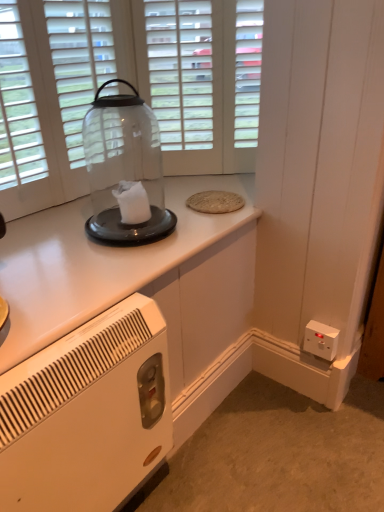
Question: Is the depth of white plastic heater at lower left greater than that of white plastic electrical outlet at lower right?

Choices:
 (A) no
 (B) yes

Answer: (A)

Question: Is the position of white plastic heater at lower left less distant than that of white plastic electrical outlet at lower right?

Choices:
 (A) yes
 (B) no

Answer: (A)

Question: From the image's perspective, is white plastic heater at lower left beneath white plastic electrical outlet at lower right?

Choices:
 (A) yes
 (B) no

Answer: (A)

Question: Considering the relative sizes of white plastic heater at lower left and white plastic electrical outlet at lower right in the image provided, is white plastic heater at lower left wider than white plastic electrical outlet at lower right?

Choices:
 (A) no
 (B) yes

Answer: (B)

Question: From the image's perspective, does white plastic heater at lower left appear higher than white plastic electrical outlet at lower right?

Choices:
 (A) no
 (B) yes

Answer: (A)

Question: Is white plastic heater at lower left thinner than white plastic electrical outlet at lower right?

Choices:
 (A) no
 (B) yes

Answer: (A)

Question: Is white glossy cabinet at upper center at the right side of transparent glass door at upper center?

Choices:
 (A) yes
 (B) no

Answer: (B)

Question: Is white glossy cabinet at upper center in contact with transparent glass door at upper center?

Choices:
 (A) no
 (B) yes

Answer: (A)

Question: Does white glossy cabinet at upper center have a lesser height compared to transparent glass door at upper center?

Choices:
 (A) yes
 (B) no

Answer: (A)

Question: Is white glossy cabinet at upper center wider than transparent glass door at upper center?

Choices:
 (A) no
 (B) yes

Answer: (B)

Question: Considering the relative sizes of white glossy cabinet at upper center and transparent glass door at upper center in the image provided, is white glossy cabinet at upper center smaller than transparent glass door at upper center?

Choices:
 (A) yes
 (B) no

Answer: (B)

Question: From a real-world perspective, is white glossy cabinet at upper center over transparent glass door at upper center?

Choices:
 (A) yes
 (B) no

Answer: (B)

Question: Is white glossy cabinet at upper center turned away from white plastic heater at lower left?

Choices:
 (A) no
 (B) yes

Answer: (A)